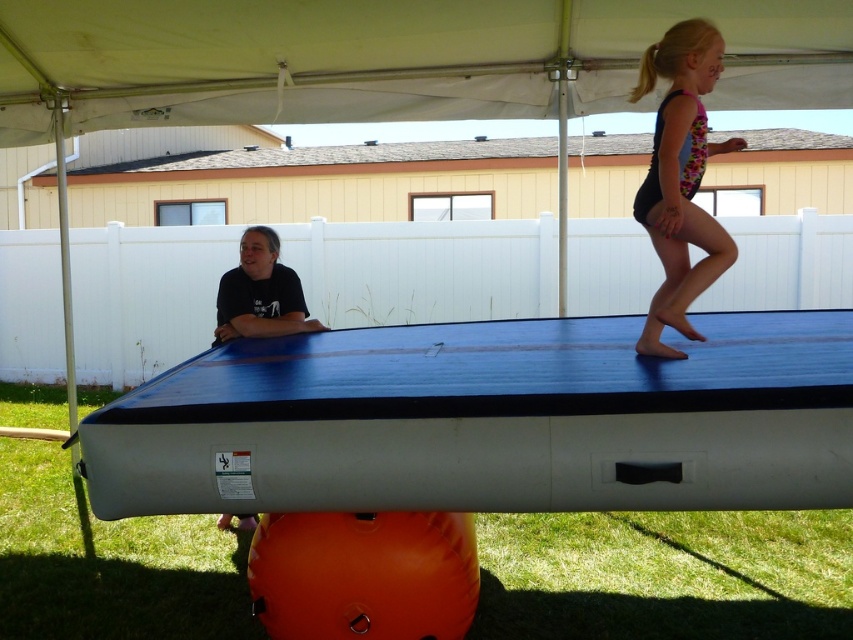
You are a photographer positioned at the center of the tent. You want to capture a photo that includes both the multicolored leotard at upper right and the black matte shirt at left. Which object should you adjust your camera angle upwards to include?

You should adjust your camera angle upwards to include the multicolored leotard at upper right because it is positioned above the black matte shirt at left.

You are a photographer positioned outside the large white canopy tent. You want to capture a photo of the blue rubber mat at upper center and the multicolored leotard at upper right without any obstructions. Based on their positions, which object should you focus on first to ensure both are in the frame?

The blue rubber mat at upper center is in front of the multicolored leotard at upper right, so you should focus on the multicolored leotard at upper right first to ensure it doesn not get obstructed by the blue rubber mat at upper center.